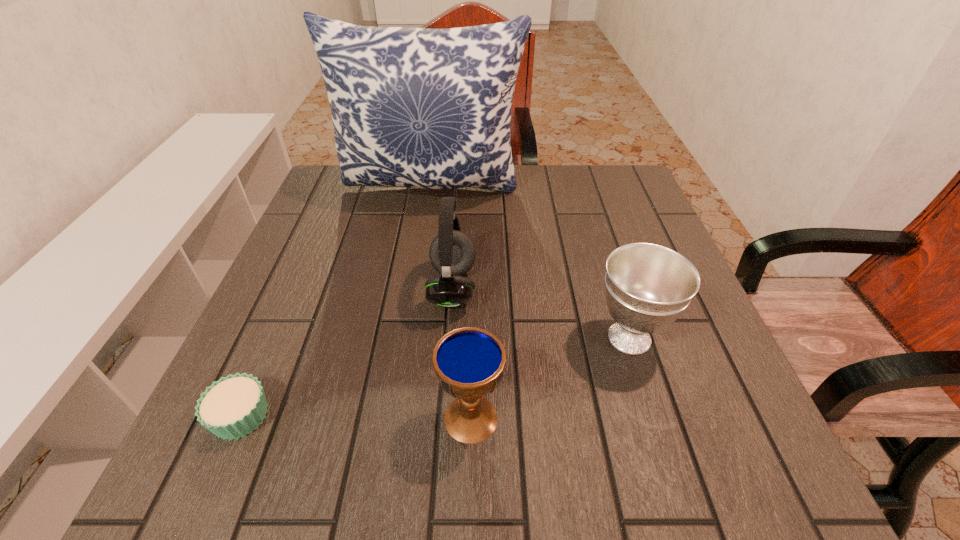
Find the location of a particular element. free region located 0.200m on the right of the left chalice is located at coordinates (630, 418).

In order to click on free space located 0.370m on the right of the cupcake in this screenshot , I will do `click(506, 416)`.

In order to click on object that is positioned at the far edge in this screenshot , I will do `click(424, 108)`.

The height and width of the screenshot is (540, 960). In order to click on chalice that is at the near edge in this screenshot , I will do `click(469, 362)`.

Image resolution: width=960 pixels, height=540 pixels. Find the location of `cupcake situated at the near edge`. cupcake situated at the near edge is located at coordinates (234, 406).

Where is `cushion that is at the left edge`? The image size is (960, 540). cushion that is at the left edge is located at coordinates (424, 108).

This screenshot has height=540, width=960. Find the location of `cupcake at the left edge`. cupcake at the left edge is located at coordinates (234, 406).

This screenshot has width=960, height=540. In order to click on object that is at the right edge in this screenshot , I will do `click(647, 286)`.

The height and width of the screenshot is (540, 960). Identify the location of object at the far left corner. (424, 108).

This screenshot has width=960, height=540. I want to click on object located in the near left corner section of the desktop, so click(x=234, y=406).